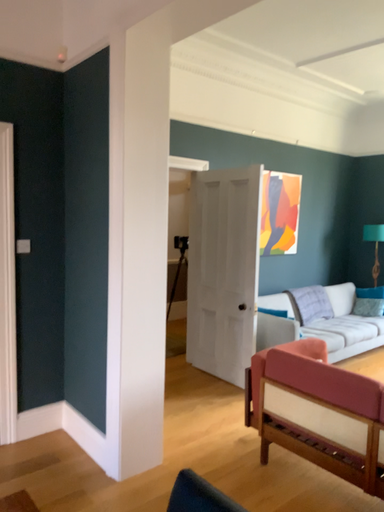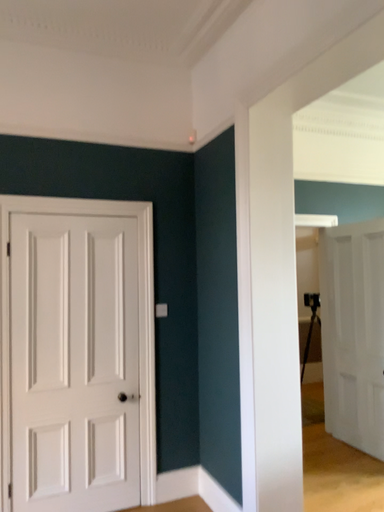
Question: Which way did the camera rotate in the video?

Choices:
 (A) rotated downward
 (B) rotated upward

Answer: (B)